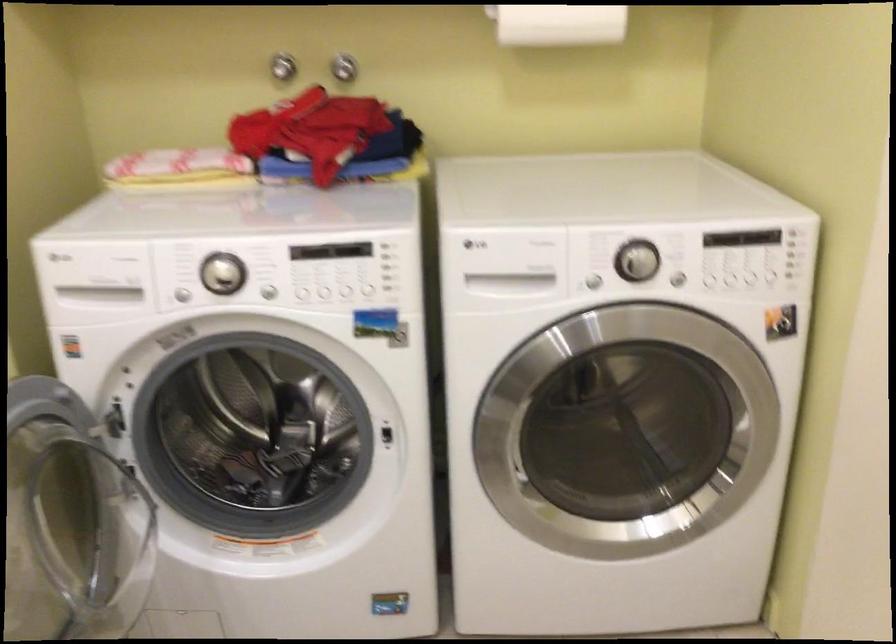
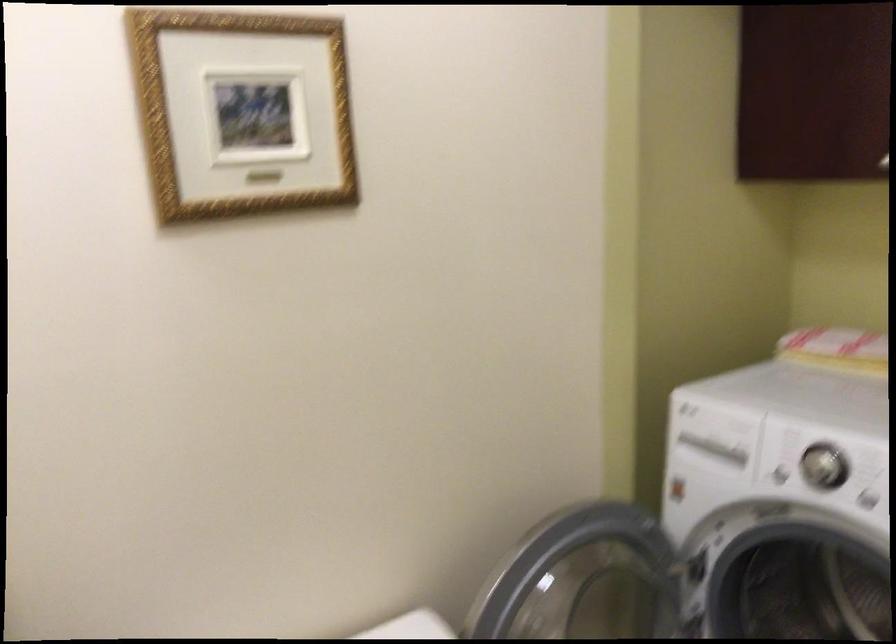
Locate, in the second image, the point that corresponds to point (95, 299) in the first image.

(708, 451)